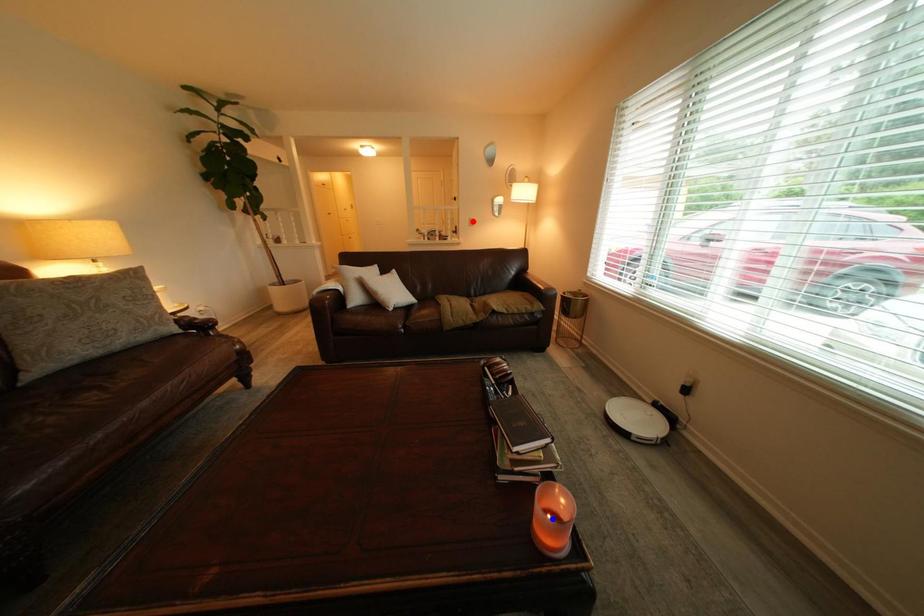
Question: Two points are marked on the image. Which point is closer to the camera?

Choices:
 (A) Blue point is closer.
 (B) Red point is closer.

Answer: (A)